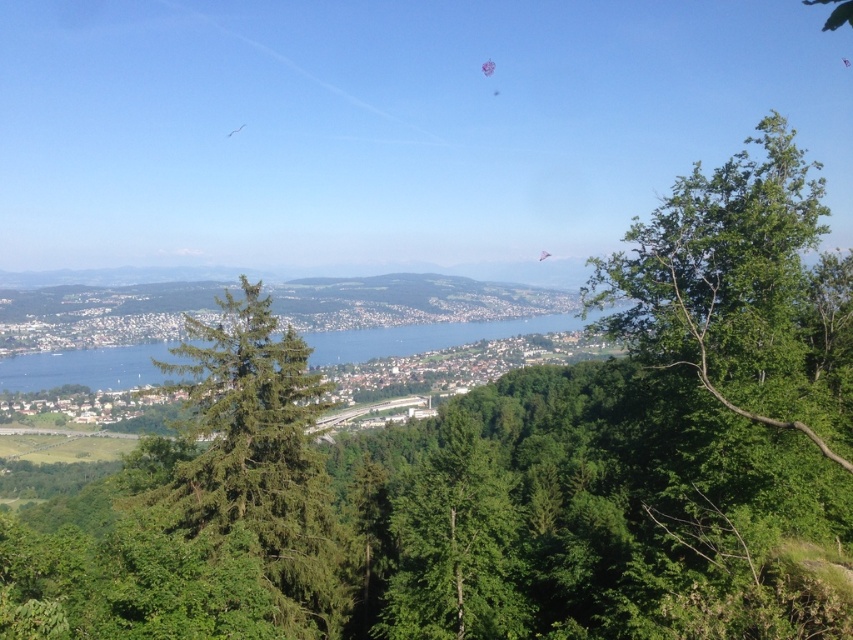
Is green needle-like tree at center behind green leafy tree at center?

No, green needle-like tree at center is closer to the viewer.

Who is taller, green needle-like tree at center or green leafy tree at center?

green leafy tree at center is taller.

What do you see at coordinates (260, 460) in the screenshot? The height and width of the screenshot is (640, 853). I see `green needle-like tree at center` at bounding box center [260, 460].

Identify the location of green needle-like tree at center. The width and height of the screenshot is (853, 640). (260, 460).